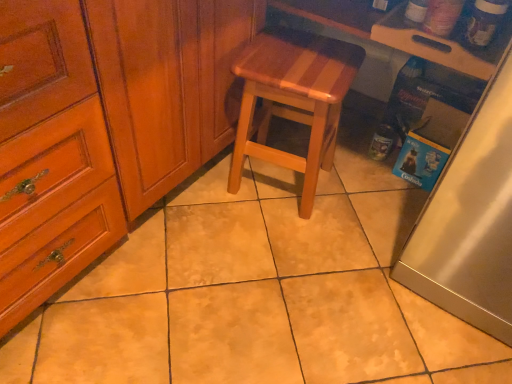
Question: From a real-world perspective, is satin silver fridge at right positioned above or below natural wood stool at center?

Choices:
 (A) above
 (B) below

Answer: (A)

Question: Based on their positions, is satin silver fridge at right located to the left or right of natural wood stool at center?

Choices:
 (A) right
 (B) left

Answer: (A)

Question: Based on their relative distances, which object is farther from the satin silver fridge at right?

Choices:
 (A) natural wood stool at center
 (B) wooden cutting board at upper right

Answer: (A)

Question: Which object is positioned farthest from the wooden cutting board at upper right?

Choices:
 (A) natural wood stool at center
 (B) satin silver fridge at right

Answer: (B)